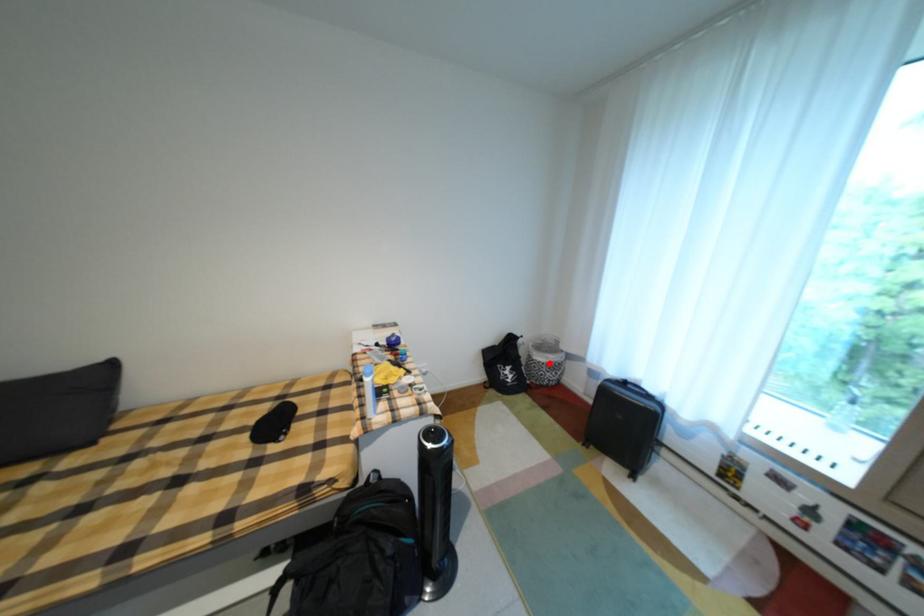
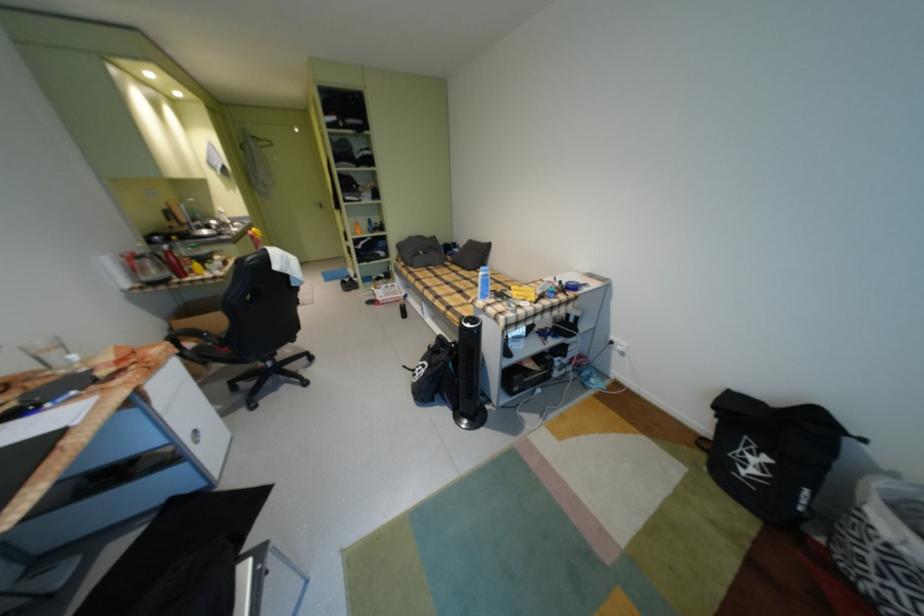
In the second image, find the point that corresponds to the highlighted location in the first image.

(882, 529)